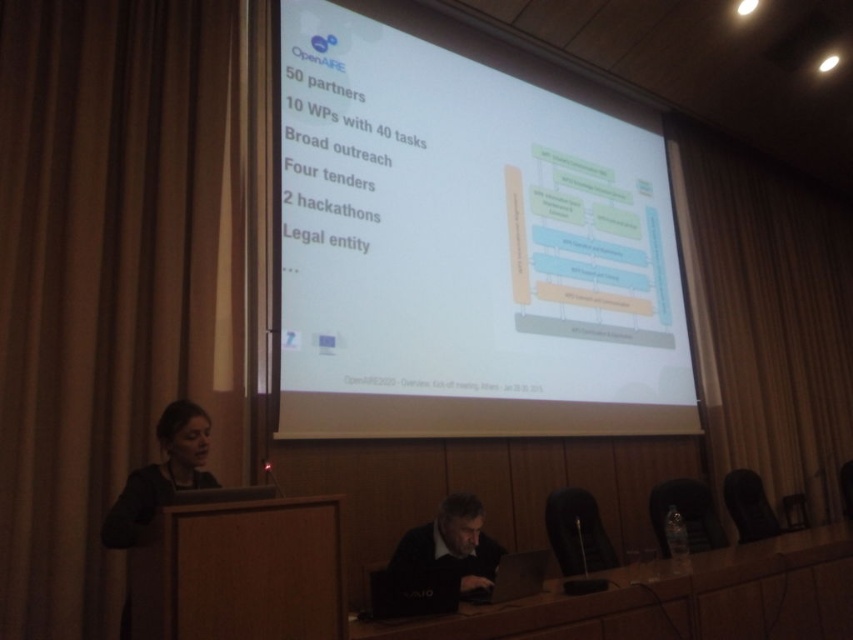
Question: Does brown fabric curtain at left have a lesser width compared to black fabric at lower left?

Choices:
 (A) no
 (B) yes

Answer: (A)

Question: Among these objects, which one is farthest from the camera?

Choices:
 (A) beige fabric curtain at right
 (B) wooden table at lower center

Answer: (A)

Question: Which object is farther from the camera taking this photo?

Choices:
 (A) white matte projector screen at center
 (B) black fabric at lower left
 (C) wooden table at lower center
 (D) beige fabric curtain at right

Answer: (D)

Question: Which object is farther from the camera taking this photo?

Choices:
 (A) white matte projector screen at center
 (B) brown fabric curtain at left
 (C) black fabric at lower left
 (D) beige fabric curtain at right

Answer: (D)

Question: Can you confirm if white matte projector screen at center is thinner than black fabric at lower left?

Choices:
 (A) no
 (B) yes

Answer: (A)

Question: Can you confirm if brown fabric curtain at left is bigger than black fabric at lower left?

Choices:
 (A) yes
 (B) no

Answer: (A)